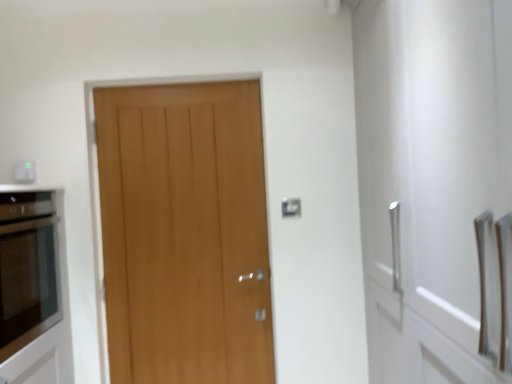
Question: From the image's perspective, would you say matte glass oven at left is shown under wooden door at center?

Choices:
 (A) no
 (B) yes

Answer: (B)

Question: From a real-world perspective, does matte glass oven at left stand above wooden door at center?

Choices:
 (A) no
 (B) yes

Answer: (A)

Question: From the image's perspective, is matte glass oven at left above wooden door at center?

Choices:
 (A) yes
 (B) no

Answer: (B)

Question: Could you tell me if matte glass oven at left is turned towards wooden door at center?

Choices:
 (A) no
 (B) yes

Answer: (B)

Question: Is matte glass oven at left taller than wooden door at center?

Choices:
 (A) no
 (B) yes

Answer: (A)

Question: Is matte glass oven at left facing away from wooden door at center?

Choices:
 (A) yes
 (B) no

Answer: (B)

Question: Does white plastic electric outlet at upper left have a greater width compared to wooden door at center?

Choices:
 (A) no
 (B) yes

Answer: (A)

Question: From a real-world perspective, is white plastic electric outlet at upper left physically above wooden door at center?

Choices:
 (A) no
 (B) yes

Answer: (B)

Question: From a real-world perspective, is white plastic electric outlet at upper left physically below wooden door at center?

Choices:
 (A) no
 (B) yes

Answer: (A)

Question: Is white plastic electric outlet at upper left smaller than wooden door at center?

Choices:
 (A) yes
 (B) no

Answer: (A)

Question: Is white plastic electric outlet at upper left bigger than wooden door at center?

Choices:
 (A) no
 (B) yes

Answer: (A)

Question: Is white plastic electric outlet at upper left next to wooden door at center?

Choices:
 (A) no
 (B) yes

Answer: (A)

Question: Is matte glass oven at left completely or partially inside white plastic electric outlet at upper left?

Choices:
 (A) yes
 (B) no

Answer: (B)